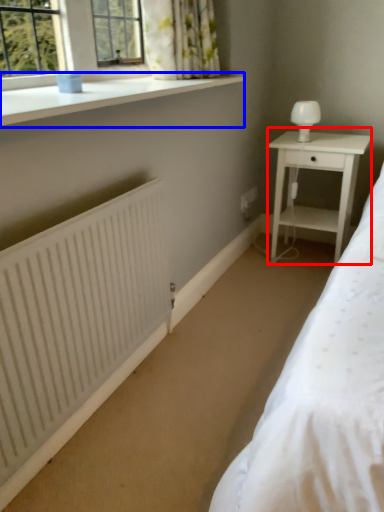
Question: Which point is further to the camera, nightstand (highlighted by a red box) or window sill (highlighted by a blue box)?

Choices:
 (A) nightstand
 (B) window sill

Answer: (A)